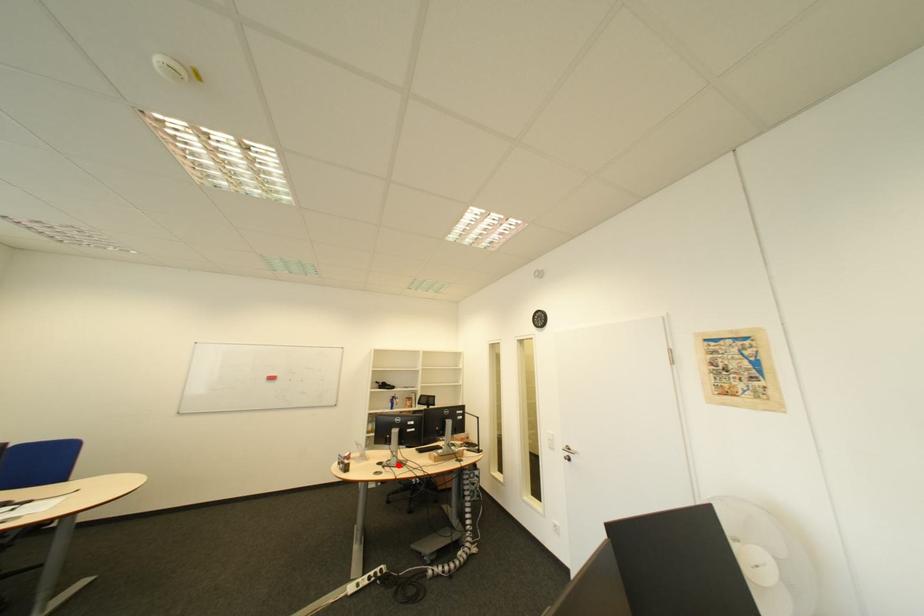
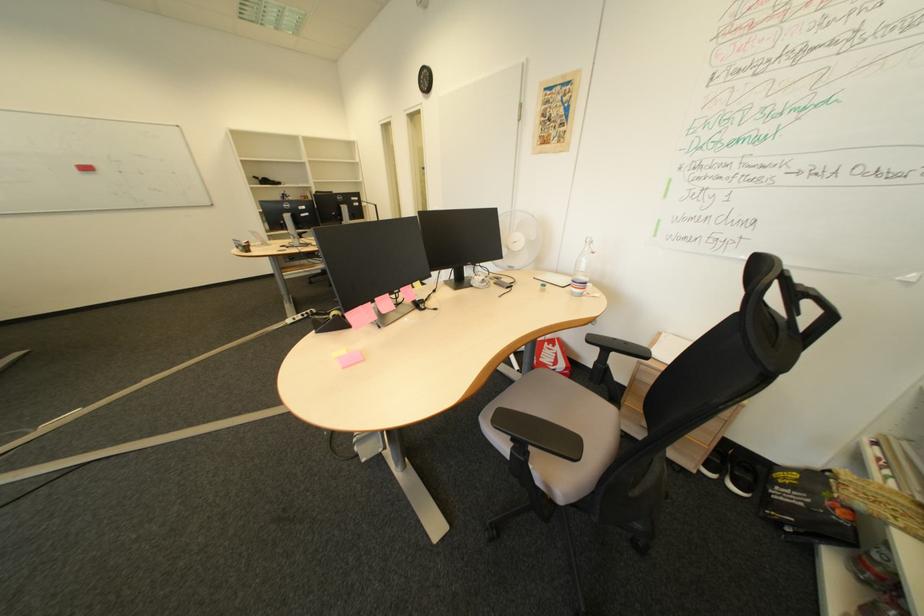
Question: I am providing you with two images of the same scene from different viewpoints. Given a red point in image1, look at the same physical point in image2. Is it:

Choices:
 (A) Closer to the viewpoint
 (B) Farther from the viewpoint

Answer: (A)